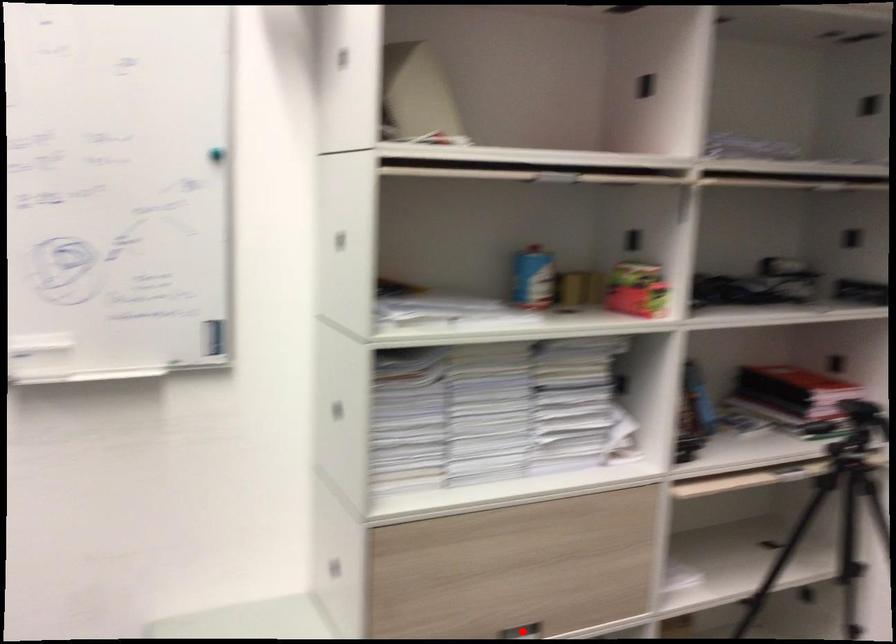
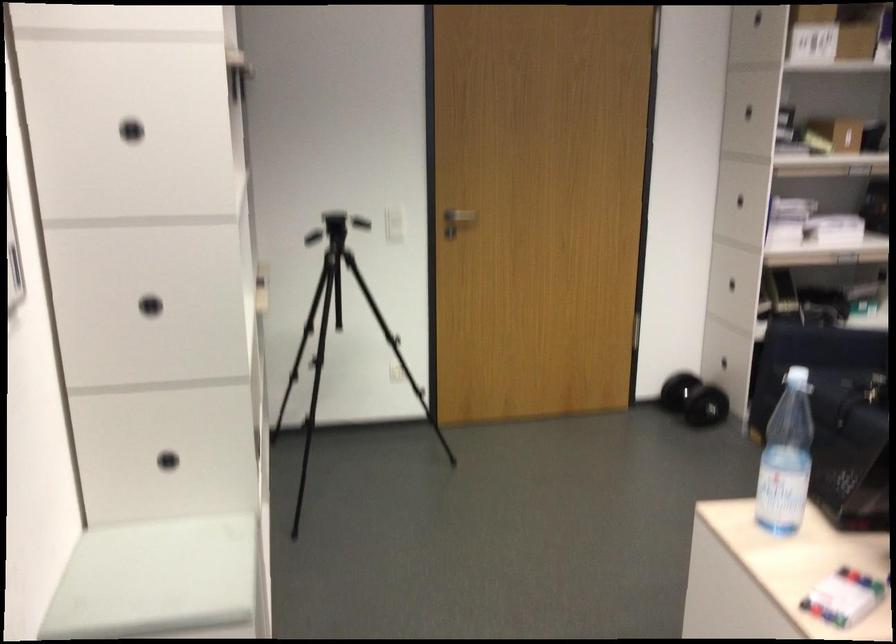
Question: I am providing you with two images of the same scene from different viewpoints. A red point is marked on the first image. Can you still see the location of the red point in image 2?

Choices:
 (A) Yes
 (B) No

Answer: (B)